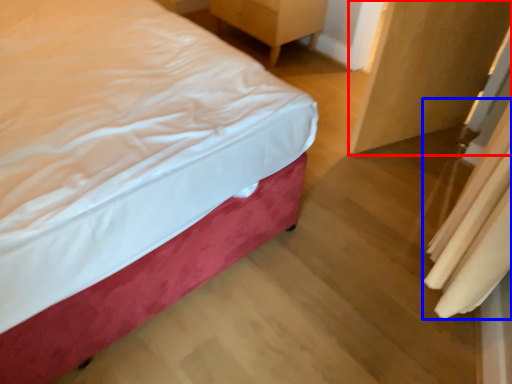
Question: Which object appears farthest to the camera in this image, armoire (highlighted by a red box) or curtain (highlighted by a blue box)?

Choices:
 (A) armoire
 (B) curtain

Answer: (A)